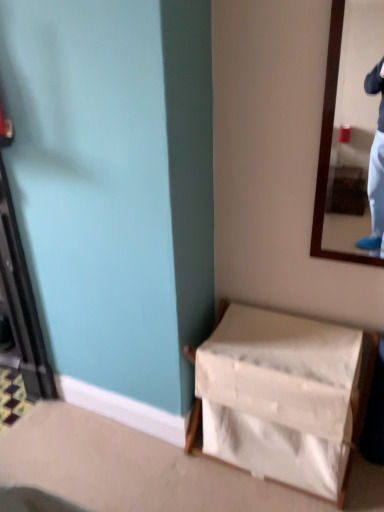
Question: Is wooden-framed mirror at upper right wider or thinner than white fabric basket at lower right?

Choices:
 (A) wide
 (B) thin

Answer: (B)

Question: Is wooden-framed mirror at upper right in front of or behind white fabric basket at lower right in the image?

Choices:
 (A) behind
 (B) front

Answer: (B)

Question: From a real-world perspective, is wooden-framed mirror at upper right above or below white fabric basket at lower right?

Choices:
 (A) above
 (B) below

Answer: (A)

Question: Is point (316, 350) closer or farther from the camera than point (331, 77)?

Choices:
 (A) closer
 (B) farther

Answer: (B)

Question: From a real-world perspective, relative to wooden-framed mirror at upper right, is white fabric basket at lower right vertically above or below?

Choices:
 (A) above
 (B) below

Answer: (B)

Question: In terms of size, does white fabric basket at lower right appear bigger or smaller than wooden-framed mirror at upper right?

Choices:
 (A) big
 (B) small

Answer: (A)

Question: Visually, is white fabric basket at lower right positioned to the left or to the right of wooden-framed mirror at upper right?

Choices:
 (A) left
 (B) right

Answer: (A)